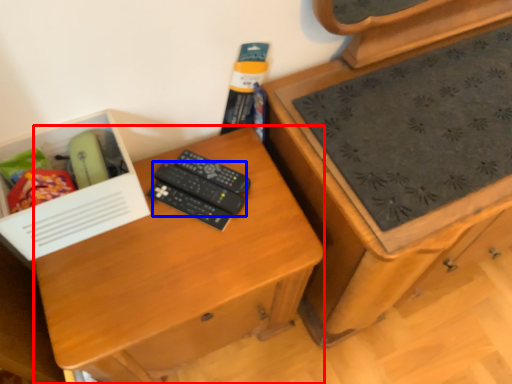
Question: Among these objects, which one is farthest to the camera, desk (highlighted by a red box) or remote control (highlighted by a blue box)?

Choices:
 (A) desk
 (B) remote control

Answer: (B)